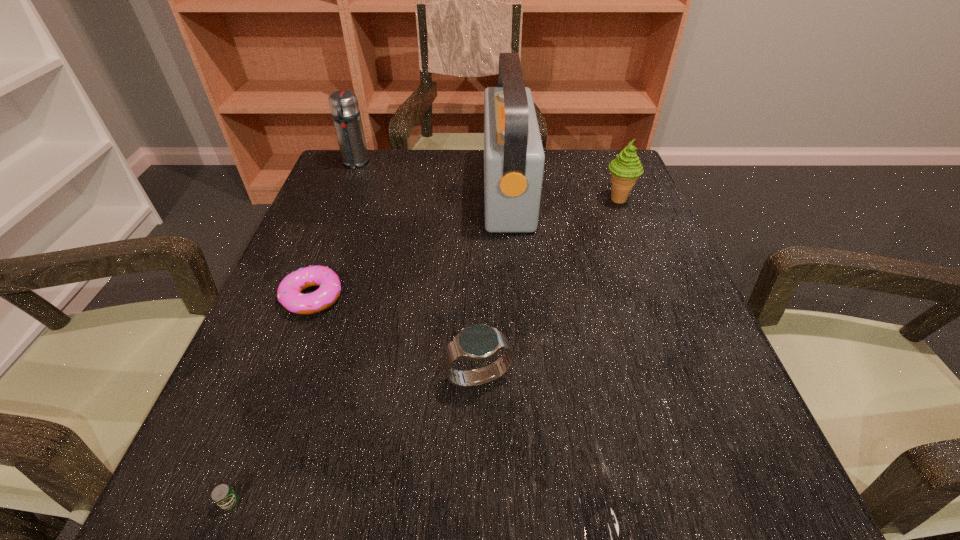
At what (x,y) coordinates should I click in order to perform the action: click on free region located 0.130m on the front-facing side of the radio receiver. Please return your answer as a coordinate pair (x, y). Image resolution: width=960 pixels, height=540 pixels. Looking at the image, I should click on (431, 191).

At what (x,y) coordinates should I click in order to perform the action: click on blank space located 0.160m on the front-facing side of the radio receiver. Please return your answer as a coordinate pair (x, y). Looking at the image, I should click on (419, 191).

You are a GUI agent. You are given a task and a screenshot of the screen. Output one action in this format:
    pyautogui.click(x=<x>, y=<y>)
    Task: Click on the free region located on the front-facing side of the radio receiver
    
    Given the screenshot: What is the action you would take?
    pyautogui.click(x=381, y=191)

Identify the location of free space located 0.070m with a handle on the side of the thermos bottle. This screenshot has width=960, height=540. (346, 187).

Locate an element on the screen. Image resolution: width=960 pixels, height=540 pixels. vacant space located on the back of the rightmost object is located at coordinates (604, 164).

Find the location of a particular element. This screenshot has width=960, height=540. vacant point located on the back of the second nearest object is located at coordinates [x=479, y=319].

Find the location of `vacant space located on the back of the second shortest object`. vacant space located on the back of the second shortest object is located at coordinates (360, 172).

Where is `vacant area situated on the back of the nearest object`? The width and height of the screenshot is (960, 540). vacant area situated on the back of the nearest object is located at coordinates (279, 374).

Where is `radio receiver that is at the far edge`? The image size is (960, 540). radio receiver that is at the far edge is located at coordinates (514, 158).

Locate an element on the screen. The width and height of the screenshot is (960, 540). thermos bottle located at the far edge is located at coordinates (344, 106).